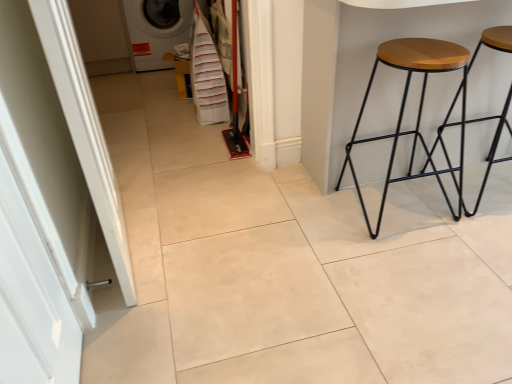
Question: Does white glossy washing machine at upper left come behind white glossy door at left?

Choices:
 (A) yes
 (B) no

Answer: (A)

Question: Is white glossy washing machine at upper left closer to camera compared to white glossy door at left?

Choices:
 (A) no
 (B) yes

Answer: (A)

Question: Does white glossy washing machine at upper left have a greater width compared to white glossy door at left?

Choices:
 (A) yes
 (B) no

Answer: (A)

Question: Is white glossy washing machine at upper left far from white glossy door at left?

Choices:
 (A) yes
 (B) no

Answer: (A)

Question: Is the surface of white glossy washing machine at upper left in direct contact with white glossy door at left?

Choices:
 (A) yes
 (B) no

Answer: (B)

Question: Is white glossy door at left situated inside white fabric laundry at center or outside?

Choices:
 (A) outside
 (B) inside

Answer: (A)

Question: Is white glossy door at left wider or thinner than white fabric laundry at center?

Choices:
 (A) thin
 (B) wide

Answer: (A)

Question: From the image's perspective, is white glossy door at left above or below white fabric laundry at center?

Choices:
 (A) above
 (B) below

Answer: (B)

Question: Based on their sizes in the image, would you say white glossy door at left is bigger or smaller than white fabric laundry at center?

Choices:
 (A) big
 (B) small

Answer: (B)

Question: Is point (508, 51) closer or farther from the camera than point (409, 82)?

Choices:
 (A) farther
 (B) closer

Answer: (A)

Question: Looking at their shapes, would you say wooden seat stool at right, which appears as the second stool when viewed from the left, is wider or thinner than wooden/black metal stool at right, the 2th stool when ordered from right to left?

Choices:
 (A) wide
 (B) thin

Answer: (B)

Question: Visually, is wooden seat stool at right, which appears as the second stool when viewed from the left, positioned to the left or to the right of wooden/black metal stool at right, the 2th stool when ordered from right to left?

Choices:
 (A) right
 (B) left

Answer: (A)

Question: Do you think wooden seat stool at right, which ranks as the 1th stool in right-to-left order, is within wooden/black metal stool at right, the 2th stool when ordered from right to left, or outside of it?

Choices:
 (A) inside
 (B) outside

Answer: (B)

Question: From their relative heights in the image, would you say white glossy door at left is taller or shorter than wooden stool at right?

Choices:
 (A) short
 (B) tall

Answer: (A)

Question: Visually, is white glossy door at left positioned to the left or to the right of wooden stool at right?

Choices:
 (A) right
 (B) left

Answer: (B)